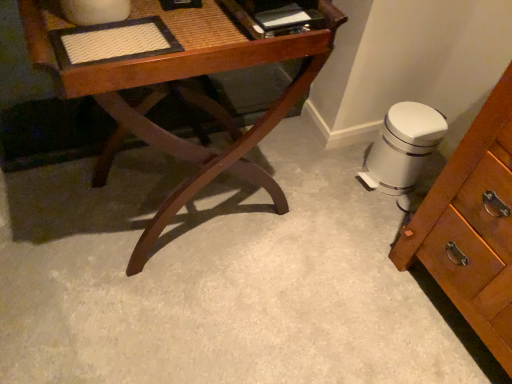
Question: Is white glossy trash can at lower right in front of or behind glossy wood desk at center in the image?

Choices:
 (A) front
 (B) behind

Answer: (B)

Question: From their relative heights in the image, would you say white glossy trash can at lower right is taller or shorter than glossy wood desk at center?

Choices:
 (A) short
 (B) tall

Answer: (A)

Question: From the image's perspective, relative to glossy wood desk at center, is white glossy trash can at lower right above or below?

Choices:
 (A) above
 (B) below

Answer: (B)

Question: Does point (131, 127) appear closer or farther from the camera than point (376, 183)?

Choices:
 (A) farther
 (B) closer

Answer: (B)

Question: Relative to white glossy trash can at lower right, is glossy wood desk at center in front or behind?

Choices:
 (A) behind
 (B) front

Answer: (B)

Question: In terms of size, does glossy wood desk at center appear bigger or smaller than white glossy trash can at lower right?

Choices:
 (A) small
 (B) big

Answer: (B)

Question: Is glossy wood desk at center inside or outside of white glossy trash can at lower right?

Choices:
 (A) outside
 (B) inside

Answer: (A)